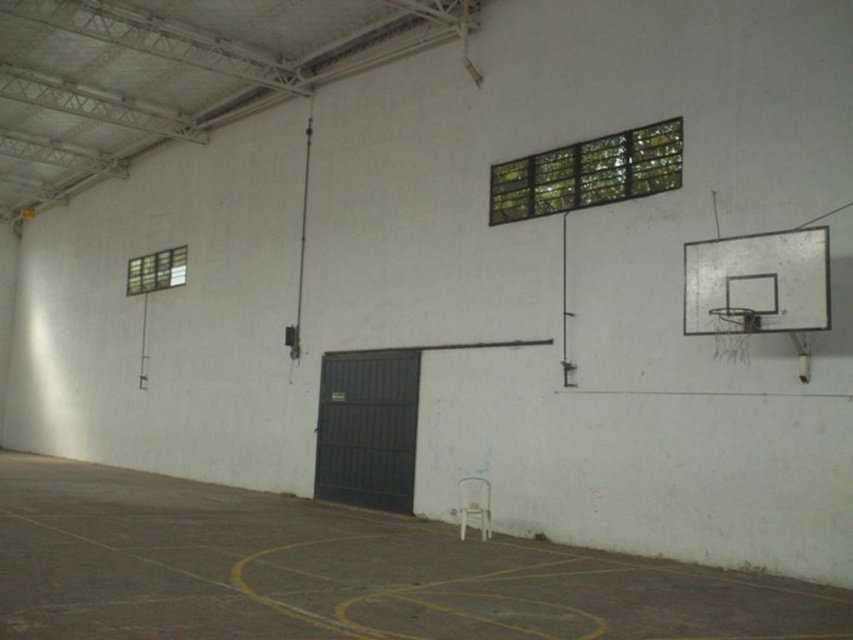
Does white plastic chair at center come behind metallic silver basketball hoop at right?

No, it is not.

Is white plastic chair at center taller than metallic silver basketball hoop at right?

Indeed, white plastic chair at center has a greater height compared to metallic silver basketball hoop at right.

Does point (299, 573) come farther from viewer compared to point (727, 310)?

No, (299, 573) is closer to viewer.

Locate an element on the screen. This screenshot has height=640, width=853. white plastic chair at center is located at coordinates (340, 572).